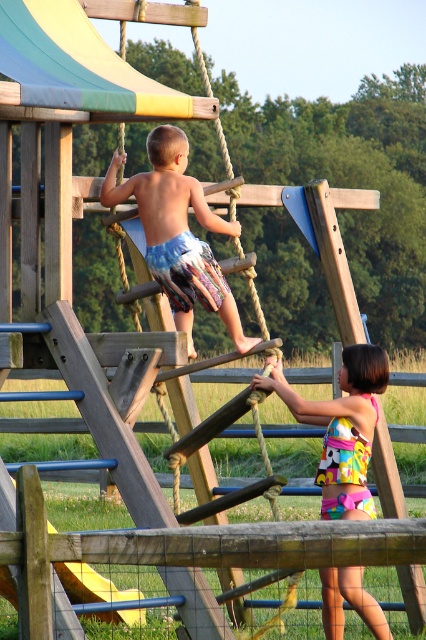
Question: Based on their relative distances, which object is nearer to the yellow plastic slide at lower left?

Choices:
 (A) multicolored fabric swimsuit at center
 (B) blue patterned shorts at center

Answer: (B)

Question: Which point is closer to the camera taking this photo?

Choices:
 (A) (311, 410)
 (B) (63, 582)

Answer: (A)

Question: Based on their relative distances, which object is farther from the yellow plastic slide at lower left?

Choices:
 (A) blue patterned shorts at center
 (B) multicolored plastic slide at upper left
 (C) multicolored fabric swimsuit at center

Answer: (B)

Question: Is multicolored plastic slide at upper left thinner than multicolored fabric swimsuit at center?

Choices:
 (A) no
 (B) yes

Answer: (A)

Question: Does blue patterned shorts at center have a lesser width compared to multicolored fabric swimsuit at center?

Choices:
 (A) yes
 (B) no

Answer: (B)

Question: Does blue patterned shorts at center appear over yellow plastic slide at lower left?

Choices:
 (A) yes
 (B) no

Answer: (A)